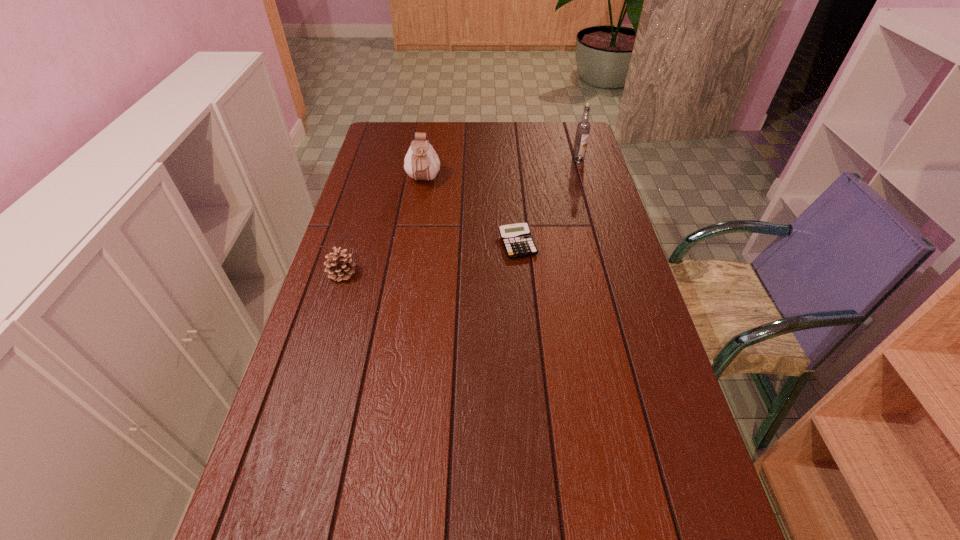
Identify the location of free location located 0.390m on the front of the leftmost object. This screenshot has height=540, width=960. (299, 417).

Locate an element on the screen. vacant space located on the left of the shortest object is located at coordinates (452, 244).

The image size is (960, 540). Identify the location of object that is at the left edge. (339, 265).

Locate an element on the screen. object that is at the right edge is located at coordinates [x=583, y=128].

Locate an element on the screen. Image resolution: width=960 pixels, height=540 pixels. vacant space at the left edge is located at coordinates (323, 307).

The height and width of the screenshot is (540, 960). I want to click on vacant position at the right edge of the desktop, so click(662, 380).

Find the location of a particular element. vacant space at the far right corner of the desktop is located at coordinates (x=546, y=129).

The height and width of the screenshot is (540, 960). What are the coordinates of `vacant space in between the rightmost object and the shortest object` in the screenshot? It's located at (548, 202).

This screenshot has width=960, height=540. I want to click on vacant space that's between the third object from right to left and the second shortest object, so click(x=383, y=227).

Where is `free point between the third shortest object and the calculator`? The image size is (960, 540). free point between the third shortest object and the calculator is located at coordinates (470, 213).